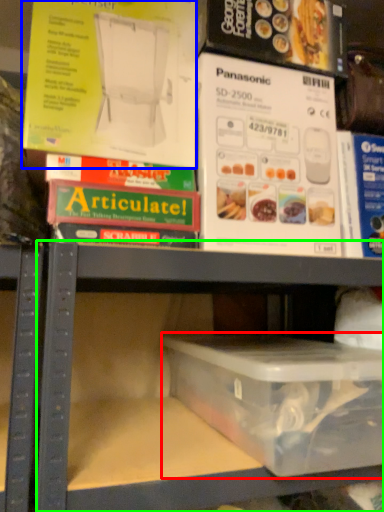
Question: Based on their relative distances, which object is farther from box (highlighted by a red box)? Choose from paperback book (highlighted by a blue box) and shelf (highlighted by a green box).

Choices:
 (A) paperback book
 (B) shelf

Answer: (A)